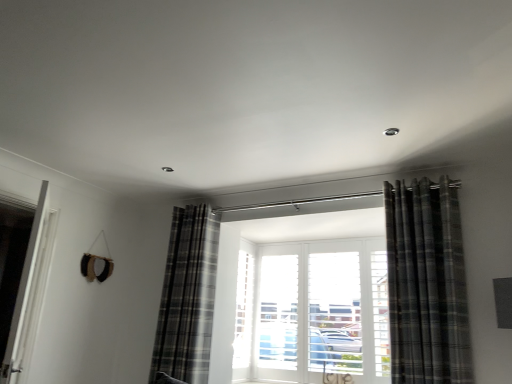
Question: Is plaid fabric curtain at right, the 2th curtain positioned from the left, facing towards white glossy door at left?

Choices:
 (A) yes
 (B) no

Answer: (B)

Question: Could white glossy door at left be considered to be inside plaid fabric curtain at right, marked as the 1th curtain in a front-to-back arrangement?

Choices:
 (A) yes
 (B) no

Answer: (B)

Question: Can you confirm if plaid fabric curtain at right, the 2th curtain positioned from the left, is positioned to the left of white glossy door at left?

Choices:
 (A) yes
 (B) no

Answer: (B)

Question: Is plaid fabric curtain at right, placed as the first curtain when sorted from right to left, touching white glossy door at left?

Choices:
 (A) yes
 (B) no

Answer: (B)

Question: Is plaid fabric curtain at right, marked as the 1th curtain in a front-to-back arrangement, thinner than white glossy door at left?

Choices:
 (A) no
 (B) yes

Answer: (A)

Question: Can you confirm if plaid fabric curtain at right, the 2th curtain positioned from the left, is taller than white glossy door at left?

Choices:
 (A) yes
 (B) no

Answer: (A)

Question: Is plaid fabric curtain at center, positioned as the first curtain in left-to-right order, at the left side of white glossy door at left?

Choices:
 (A) no
 (B) yes

Answer: (A)

Question: Is plaid fabric curtain at center, the 2th curtain from the right, far away from white glossy door at left?

Choices:
 (A) yes
 (B) no

Answer: (A)

Question: Is plaid fabric curtain at center, the second curtain when ordered from front to back, facing away from white glossy door at left?

Choices:
 (A) no
 (B) yes

Answer: (A)

Question: Does plaid fabric curtain at center, which is the 1th curtain in back-to-front order, have a larger size compared to white glossy door at left?

Choices:
 (A) no
 (B) yes

Answer: (B)

Question: From a real-world perspective, is plaid fabric curtain at center, the second curtain when ordered from front to back, located higher than white glossy door at left?

Choices:
 (A) yes
 (B) no

Answer: (A)

Question: From a real-world perspective, is plaid fabric curtain at center, which is the 1th curtain in back-to-front order, below white glossy door at left?

Choices:
 (A) yes
 (B) no

Answer: (B)

Question: Does white glossy door at left have a lesser width compared to plaid fabric curtain at right, marked as the 1th curtain in a front-to-back arrangement?

Choices:
 (A) no
 (B) yes

Answer: (B)